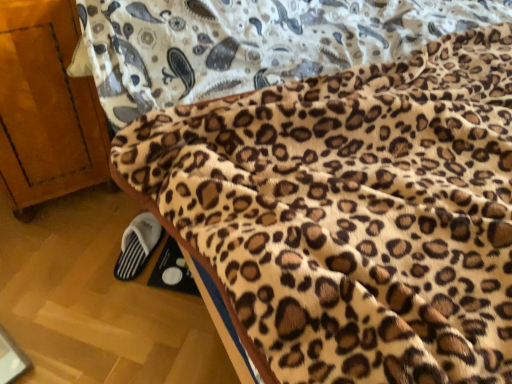
Question: Considering the relative sizes of leopard print fleece blanket at lower right and white fabric slipper at lower left in the image provided, is leopard print fleece blanket at lower right bigger than white fabric slipper at lower left?

Choices:
 (A) yes
 (B) no

Answer: (A)

Question: Is leopard print fleece blanket at lower right in front of white fabric slipper at lower left?

Choices:
 (A) yes
 (B) no

Answer: (A)

Question: Is white fabric slipper at lower left at the back of leopard print fleece blanket at lower right?

Choices:
 (A) yes
 (B) no

Answer: (B)

Question: Is leopard print fleece blanket at lower right directly adjacent to white fabric slipper at lower left?

Choices:
 (A) yes
 (B) no

Answer: (B)

Question: Is leopard print fleece blanket at lower right facing towards white fabric slipper at lower left?

Choices:
 (A) no
 (B) yes

Answer: (B)

Question: From a real-world perspective, is white fabric slipper at lower left above or below leopard print fleece blanket at lower right?

Choices:
 (A) below
 (B) above

Answer: (B)

Question: Considering the positions of white fabric slipper at lower left and leopard print fleece blanket at lower right in the image, is white fabric slipper at lower left taller or shorter than leopard print fleece blanket at lower right?

Choices:
 (A) short
 (B) tall

Answer: (B)

Question: From the image's perspective, is white fabric slipper at lower left located above or below leopard print fleece blanket at lower right?

Choices:
 (A) below
 (B) above

Answer: (A)

Question: Considering their positions, is white fabric slipper at lower left located in front of or behind leopard print fleece blanket at lower right?

Choices:
 (A) front
 (B) behind

Answer: (B)

Question: Considering the positions of point [96, 109] and point [142, 246], is point [96, 109] closer or farther from the camera than point [142, 246]?

Choices:
 (A) closer
 (B) farther

Answer: (A)

Question: From their relative heights in the image, would you say wooden cabinet at left is taller or shorter than white fabric slipper at lower left?

Choices:
 (A) tall
 (B) short

Answer: (A)

Question: From the image's perspective, is wooden cabinet at left above or below white fabric slipper at lower left?

Choices:
 (A) above
 (B) below

Answer: (A)

Question: In the image, is wooden cabinet at left on the left side or the right side of white fabric slipper at lower left?

Choices:
 (A) left
 (B) right

Answer: (A)

Question: Considering the positions of point (241, 190) and point (51, 183), is point (241, 190) closer or farther from the camera than point (51, 183)?

Choices:
 (A) farther
 (B) closer

Answer: (B)

Question: Is leopard print fleece blanket at lower right situated inside wooden cabinet at left or outside?

Choices:
 (A) inside
 (B) outside

Answer: (B)